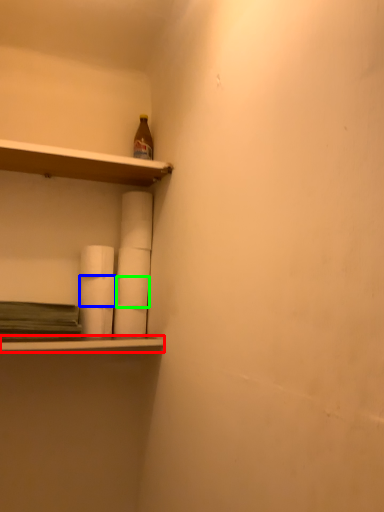
Question: Which is farther away from ledge (highlighted by a red box)? paper towel (highlighted by a blue box) or paper towel (highlighted by a green box)?

Choices:
 (A) paper towel
 (B) paper towel

Answer: (B)